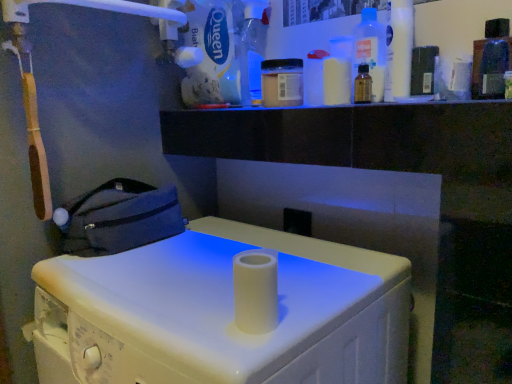
The image size is (512, 384). Find the location of `brown glass bottle at upper right, which is counted as the 3th bottle, starting from the left`. brown glass bottle at upper right, which is counted as the 3th bottle, starting from the left is located at coordinates (362, 85).

This screenshot has height=384, width=512. What do you see at coordinates (221, 313) in the screenshot? I see `white matte paper towel holder at center` at bounding box center [221, 313].

The image size is (512, 384). What do you see at coordinates (253, 48) in the screenshot?
I see `translucent plastic bottle at upper center, which appears as the fifth bottle when viewed from the right` at bounding box center [253, 48].

Image resolution: width=512 pixels, height=384 pixels. Find the location of `translucent plastic bottle at upper center, which appears as the fifth bottle when viewed from the right`. translucent plastic bottle at upper center, which appears as the fifth bottle when viewed from the right is located at coordinates (253, 48).

The height and width of the screenshot is (384, 512). What do you see at coordinates (490, 61) in the screenshot? I see `translucent plastic bottle at upper right, the first bottle when ordered from right to left` at bounding box center [490, 61].

Where is `white plastic bottle at upper center, the second bottle viewed from the left`? white plastic bottle at upper center, the second bottle viewed from the left is located at coordinates tap(338, 71).

Considering the relative positions of white matte queen bath cleaner at upper center and translucent plastic bottle at upper center, marked as the 1th bottle in a left-to-right arrangement, in the image provided, is white matte queen bath cleaner at upper center to the left or to the right of translucent plastic bottle at upper center, marked as the 1th bottle in a left-to-right arrangement,?

white matte queen bath cleaner at upper center is positioned on translucent plastic bottle at upper center, marked as the 1th bottle in a left-to-right arrangement,'s left side.

From the image's perspective, between white matte queen bath cleaner at upper center and translucent plastic bottle at upper center, which appears as the fifth bottle when viewed from the right, which one is located above?

white matte queen bath cleaner at upper center.

From the picture: Is white matte queen bath cleaner at upper center inside the boundaries of translucent plastic bottle at upper center, marked as the 1th bottle in a left-to-right arrangement, or outside?

white matte queen bath cleaner at upper center is located beyond the bounds of translucent plastic bottle at upper center, marked as the 1th bottle in a left-to-right arrangement.

Is white matte queen bath cleaner at upper center not near translucent plastic bottle at upper center, marked as the 1th bottle in a left-to-right arrangement?

They are positioned close to each other.

From the image's perspective, is brown glass bottle at upper right, positioned as the third bottle in right-to-left order, below white plastic bottle at upper center, the second bottle viewed from the left?

Yes, from the image's perspective, brown glass bottle at upper right, positioned as the third bottle in right-to-left order, is beneath white plastic bottle at upper center, the second bottle viewed from the left.

From a real-world perspective, who is located lower, brown glass bottle at upper right, which is counted as the 3th bottle, starting from the left, or white plastic bottle at upper center, the 4th bottle viewed from the right?

From a 3D spatial view, brown glass bottle at upper right, which is counted as the 3th bottle, starting from the left, is below.

Does brown glass bottle at upper right, which is counted as the 3th bottle, starting from the left, have a lesser height compared to white plastic bottle at upper center, the 4th bottle viewed from the right?

Yes, brown glass bottle at upper right, which is counted as the 3th bottle, starting from the left, is shorter than white plastic bottle at upper center, the 4th bottle viewed from the right.

Consider the image. Between brown glass bottle at upper right, positioned as the third bottle in right-to-left order, and white plastic bottle at upper center, the second bottle viewed from the left, which one appears on the left side from the viewer's perspective?

Positioned to the left is white plastic bottle at upper center, the second bottle viewed from the left.

Looking at this image, between translucent plastic bottle at upper center, marked as the 1th bottle in a left-to-right arrangement, and brown glass bottle at upper right, positioned as the third bottle in right-to-left order, which one appears on the right side from the viewer's perspective?

brown glass bottle at upper right, positioned as the third bottle in right-to-left order, is more to the right.

Does translucent plastic bottle at upper center, marked as the 1th bottle in a left-to-right arrangement, have a greater height compared to brown glass bottle at upper right, positioned as the third bottle in right-to-left order?

Indeed, translucent plastic bottle at upper center, marked as the 1th bottle in a left-to-right arrangement, has a greater height compared to brown glass bottle at upper right, positioned as the third bottle in right-to-left order.

Can you tell me how much translucent plastic bottle at upper center, which appears as the fifth bottle when viewed from the right, and brown glass bottle at upper right, which is counted as the 3th bottle, starting from the left, differ in facing direction?

The facing directions of translucent plastic bottle at upper center, which appears as the fifth bottle when viewed from the right, and brown glass bottle at upper right, which is counted as the 3th bottle, starting from the left, are 0.000443 degrees apart.

Which point is more distant from viewer, (366,100) or (381,69)?

The point (366,100) is behind.

Is brown glass bottle at upper right, positioned as the third bottle in right-to-left order, placed right next to transparent plastic bottle at upper right, positioned as the 2th bottle in right-to-left order?

Yes.

From a real-world perspective, is brown glass bottle at upper right, positioned as the third bottle in right-to-left order, under transparent plastic bottle at upper right, which is counted as the 4th bottle, starting from the left?

Correct, in the physical world, brown glass bottle at upper right, positioned as the third bottle in right-to-left order, is lower than transparent plastic bottle at upper right, which is counted as the 4th bottle, starting from the left.

Looking at this image, how distant is dark blue fabric bag at left from white plastic bottle at upper center, the 4th bottle viewed from the right?

A distance of 19.72 inches exists between dark blue fabric bag at left and white plastic bottle at upper center, the 4th bottle viewed from the right.

Is dark blue fabric bag at left not inside white plastic bottle at upper center, the second bottle viewed from the left?

Absolutely, dark blue fabric bag at left is external to white plastic bottle at upper center, the second bottle viewed from the left.

In terms of width, does dark blue fabric bag at left look wider or thinner when compared to white plastic bottle at upper center, the second bottle viewed from the left?

dark blue fabric bag at left is wider than white plastic bottle at upper center, the second bottle viewed from the left.

From the image's perspective, would you say dark blue fabric bag at left is positioned over white plastic bottle at upper center, the second bottle viewed from the left?

No, from the image's perspective, dark blue fabric bag at left is not over white plastic bottle at upper center, the second bottle viewed from the left.

Could you tell me if white matte paper towel holder at center is facing dark blue fabric bag at left?

No, white matte paper towel holder at center does not turn towards dark blue fabric bag at left.

Which is more to the right, white matte paper towel holder at center or dark blue fabric bag at left?

white matte paper towel holder at center.

Is white matte paper towel holder at center spatially inside dark blue fabric bag at left, or outside of it?

white matte paper towel holder at center is located beyond the bounds of dark blue fabric bag at left.

Based on the photo, based on their positions, is white plastic bottle at upper center, the 4th bottle viewed from the right, located to the left or right of transparent plastic bottle at upper right, which is counted as the 4th bottle, starting from the left?

In the image, white plastic bottle at upper center, the 4th bottle viewed from the right, appears on the left side of transparent plastic bottle at upper right, which is counted as the 4th bottle, starting from the left.

Could you tell me if white plastic bottle at upper center, the second bottle viewed from the left, is facing transparent plastic bottle at upper right, positioned as the 2th bottle in right-to-left order?

No, white plastic bottle at upper center, the second bottle viewed from the left, is not oriented towards transparent plastic bottle at upper right, positioned as the 2th bottle in right-to-left order.

Do you think white plastic bottle at upper center, the 4th bottle viewed from the right, is within transparent plastic bottle at upper right, positioned as the 2th bottle in right-to-left order, or outside of it?

white plastic bottle at upper center, the 4th bottle viewed from the right, cannot be found inside transparent plastic bottle at upper right, positioned as the 2th bottle in right-to-left order.

Find the location of a particular element. cleaning product on the left of the translucent plastic bottle at upper center, which appears as the fifth bottle when viewed from the right is located at coordinates (212, 54).

Locate an element on the screen. the 2nd bottle positioned below the white plastic bottle at upper center, the second bottle viewed from the left (from a real-world perspective) is located at coordinates (362, 85).

From the image, which object appears to be farther from brown glass bottle at upper right, positioned as the third bottle in right-to-left order, translucent plastic bottle at upper right, the first bottle when ordered from right to left, or white matte queen bath cleaner at upper center?

white matte queen bath cleaner at upper center is positioned further to the anchor brown glass bottle at upper right, positioned as the third bottle in right-to-left order.

Which object lies further to the anchor point dark blue fabric bag at left, white matte paper towel holder at center or translucent plastic bottle at upper center, which appears as the fifth bottle when viewed from the right?

translucent plastic bottle at upper center, which appears as the fifth bottle when viewed from the right, is further to dark blue fabric bag at left.

Considering their positions, is white matte queen bath cleaner at upper center positioned closer to brown glass bottle at upper right, positioned as the third bottle in right-to-left order, than dark blue fabric bag at left?

white matte queen bath cleaner at upper center is positioned closer to the anchor brown glass bottle at upper right, positioned as the third bottle in right-to-left order.

Based on their spatial positions, is translucent plastic bottle at upper right, the first bottle when ordered from right to left, or transparent plastic bottle at upper right, positioned as the 2th bottle in right-to-left order, closer to white matte queen bath cleaner at upper center?

The object closer to white matte queen bath cleaner at upper center is transparent plastic bottle at upper right, positioned as the 2th bottle in right-to-left order.

When comparing their distances from brown glass bottle at upper right, positioned as the third bottle in right-to-left order, does white matte paper towel holder at center or translucent plastic bottle at upper center, which appears as the fifth bottle when viewed from the right, seem closer?

translucent plastic bottle at upper center, which appears as the fifth bottle when viewed from the right, is closer to brown glass bottle at upper right, positioned as the third bottle in right-to-left order.

Estimate the real-world distances between objects in this image. Which object is further from translucent plastic bottle at upper center, which appears as the fifth bottle when viewed from the right, translucent plastic bottle at upper right, which is the fifth bottle in left-to-right order, or white matte paper towel holder at center?

white matte paper towel holder at center is positioned further to the anchor translucent plastic bottle at upper center, which appears as the fifth bottle when viewed from the right.

Looking at the image, which one is located closer to translucent plastic bottle at upper center, which appears as the fifth bottle when viewed from the right, white matte queen bath cleaner at upper center or transparent plastic bottle at upper right, which is counted as the 4th bottle, starting from the left?

white matte queen bath cleaner at upper center is positioned closer to the anchor translucent plastic bottle at upper center, which appears as the fifth bottle when viewed from the right.

When comparing their distances from white plastic bottle at upper center, the 4th bottle viewed from the right, does white matte queen bath cleaner at upper center or translucent plastic bottle at upper right, the first bottle when ordered from right to left, seem further?

white matte queen bath cleaner at upper center is positioned further to the anchor white plastic bottle at upper center, the 4th bottle viewed from the right.

Find the location of a particular element. bag between white matte queen bath cleaner at upper center and white matte paper towel holder at center in the up-down direction is located at coordinates (119, 218).

Locate an element on the screen. The height and width of the screenshot is (384, 512). bag between white plastic bottle at upper center, the second bottle viewed from the left, and white matte paper towel holder at center from top to bottom is located at coordinates (119, 218).

You are a GUI agent. You are given a task and a screenshot of the screen. Output one action in this format:
    pyautogui.click(x=<x>, y=<y>)
    Task: Click on the machine between dark blue fabric bag at left and translucent plastic bottle at upper right, the first bottle when ordered from right to left, from left to right
    Image resolution: width=512 pixels, height=384 pixels.
    Given the screenshot: What is the action you would take?
    pyautogui.click(x=221, y=313)

Where is `bottle between brown glass bottle at upper right, positioned as the third bottle in right-to-left order, and white plastic bottle at upper center, the second bottle viewed from the left, in the front-back direction`? bottle between brown glass bottle at upper right, positioned as the third bottle in right-to-left order, and white plastic bottle at upper center, the second bottle viewed from the left, in the front-back direction is located at coordinates (371, 50).